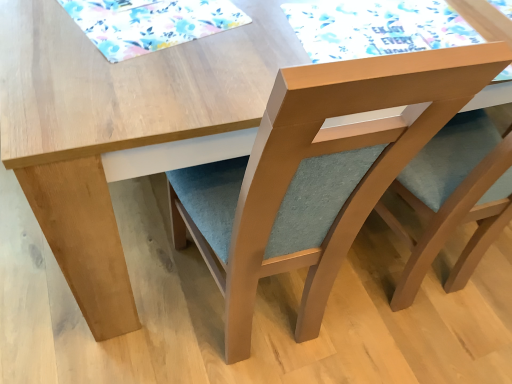
What are the coordinates of `vacant area that lies in front of floral fabric placemat at upper left, which is the second mat from right to left` in the screenshot? It's located at (100, 77).